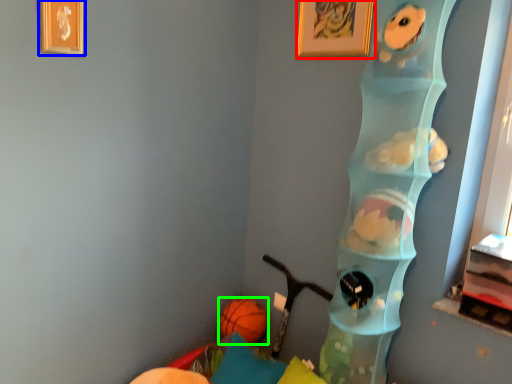
Question: Based on their relative distances, which object is nearer to picture frame (highlighted by a red box)? Choose from picture frame (highlighted by a blue box) and ball (highlighted by a green box).

Choices:
 (A) picture frame
 (B) ball

Answer: (A)